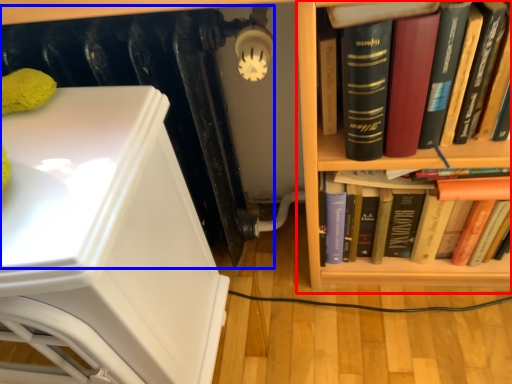
Question: Which point is further to the camera, bookcase (highlighted by a red box) or radiator (highlighted by a blue box)?

Choices:
 (A) bookcase
 (B) radiator

Answer: (B)